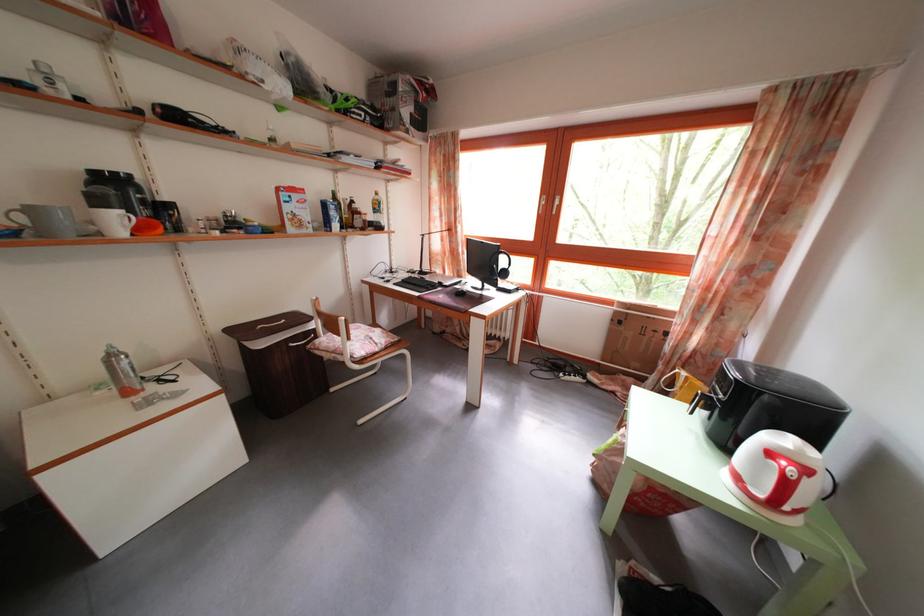
The width and height of the screenshot is (924, 616). In order to click on black appliance handle in this screenshot , I will do `click(711, 416)`.